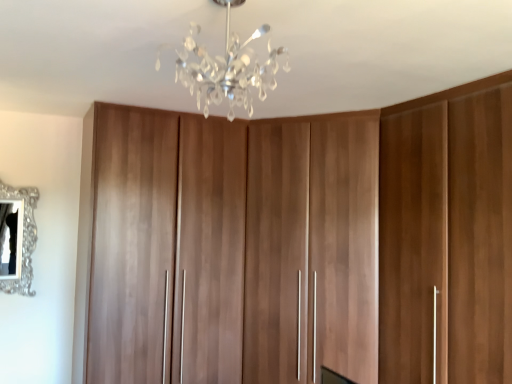
Question: Considering the relative sizes of silver ornate mirror at left and clear crystal chandelier at upper center in the image provided, is silver ornate mirror at left smaller than clear crystal chandelier at upper center?

Choices:
 (A) yes
 (B) no

Answer: (A)

Question: Does silver ornate mirror at left lie in front of clear crystal chandelier at upper center?

Choices:
 (A) no
 (B) yes

Answer: (A)

Question: Considering the relative sizes of silver ornate mirror at left and clear crystal chandelier at upper center in the image provided, is silver ornate mirror at left shorter than clear crystal chandelier at upper center?

Choices:
 (A) yes
 (B) no

Answer: (B)

Question: From the image's perspective, does silver ornate mirror at left appear higher than clear crystal chandelier at upper center?

Choices:
 (A) yes
 (B) no

Answer: (B)

Question: From the image's perspective, is silver ornate mirror at left beneath clear crystal chandelier at upper center?

Choices:
 (A) yes
 (B) no

Answer: (A)

Question: From a real-world perspective, is silver ornate mirror at left on clear crystal chandelier at upper center?

Choices:
 (A) no
 (B) yes

Answer: (A)

Question: Could you tell me if walnut wood cupboard at center is turned towards silver ornate mirror at left?

Choices:
 (A) yes
 (B) no

Answer: (B)

Question: Is walnut wood cupboard at center with silver ornate mirror at left?

Choices:
 (A) no
 (B) yes

Answer: (A)

Question: Is walnut wood cupboard at center positioned behind silver ornate mirror at left?

Choices:
 (A) no
 (B) yes

Answer: (A)

Question: Can you confirm if walnut wood cupboard at center is shorter than silver ornate mirror at left?

Choices:
 (A) yes
 (B) no

Answer: (B)

Question: Is walnut wood cupboard at center not within silver ornate mirror at left?

Choices:
 (A) yes
 (B) no

Answer: (A)

Question: Is walnut wood cupboard at center closer to the viewer compared to silver ornate mirror at left?

Choices:
 (A) no
 (B) yes

Answer: (B)

Question: Can you confirm if silver ornate mirror at left is wider than walnut wood cupboard at center?

Choices:
 (A) yes
 (B) no

Answer: (B)